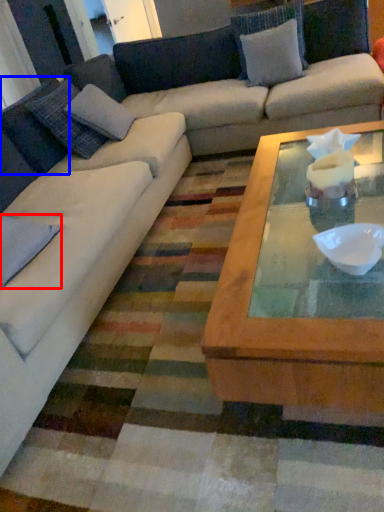
Question: Which point is further to the camera, pillow (highlighted by a red box) or pillow (highlighted by a blue box)?

Choices:
 (A) pillow
 (B) pillow

Answer: (B)